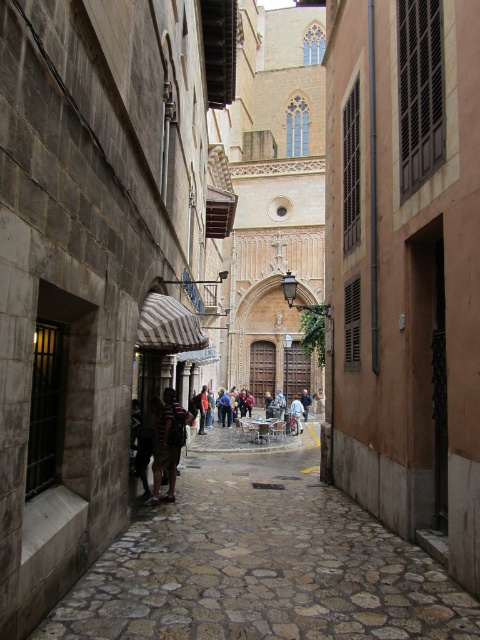
Question: From the image, what is the correct spatial relationship of stone cobblestone path at center in relation to light brown leather jacket at center?

Choices:
 (A) above
 (B) below

Answer: (A)

Question: Which point is closer to the camera taking this photo?

Choices:
 (A) (330, 554)
 (B) (299, 401)

Answer: (A)

Question: Estimate the real-world distances between objects in this image. Which object is closer to the stone cobblestone path at center?

Choices:
 (A) light brown leather jacket at center
 (B) striped fabric shirt at center

Answer: (B)

Question: Which of the following is the farthest from the observer?

Choices:
 (A) light brown leather jacket at center
 (B) stone cobblestone path at center

Answer: (A)

Question: Is stone cobblestone path at center positioned at the back of light brown leather jacket at center?

Choices:
 (A) no
 (B) yes

Answer: (A)

Question: Where is stone cobblestone path at center located in relation to light brown leather jacket at center in the image?

Choices:
 (A) above
 (B) below

Answer: (A)